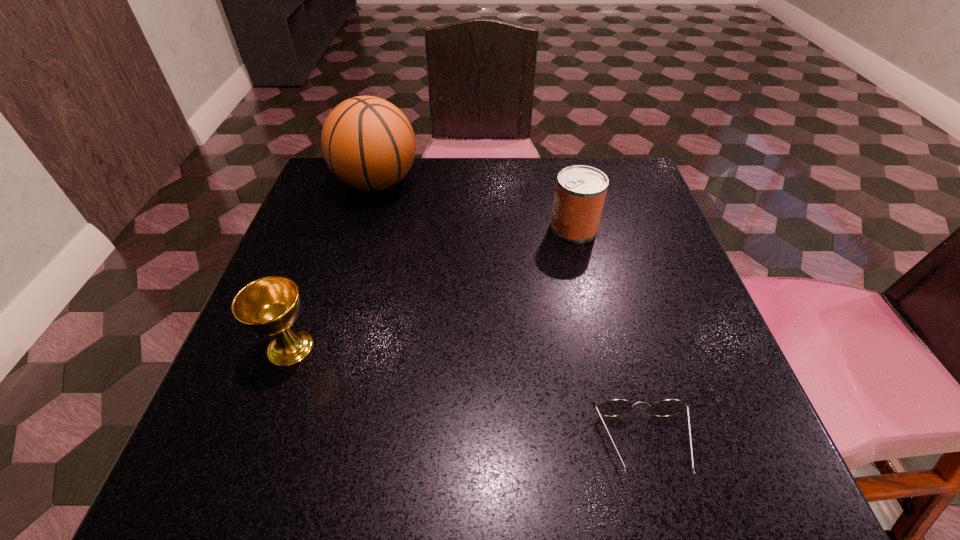
Where is `can situated at the far edge`? The height and width of the screenshot is (540, 960). can situated at the far edge is located at coordinates (580, 192).

At what (x,y) coordinates should I click in order to perform the action: click on object that is at the near edge. Please return your answer as a coordinate pair (x, y). Looking at the image, I should click on (615, 407).

At what (x,y) coordinates should I click in order to perform the action: click on basketball that is at the left edge. Please return your answer as a coordinate pair (x, y). Looking at the image, I should click on (367, 142).

Locate an element on the screen. This screenshot has width=960, height=540. chalice located in the left edge section of the desktop is located at coordinates (268, 306).

Identify the location of can that is at the right edge. This screenshot has width=960, height=540. (580, 192).

Where is `spectacles that is at the right edge`? This screenshot has height=540, width=960. spectacles that is at the right edge is located at coordinates tap(615, 407).

The height and width of the screenshot is (540, 960). I want to click on object that is positioned at the far left corner, so click(367, 142).

Find the location of `object at the far right corner`. object at the far right corner is located at coordinates (580, 192).

This screenshot has height=540, width=960. What are the coordinates of `object that is positioned at the near right corner` in the screenshot? It's located at (615, 407).

In the image, there is a desktop. Where is `free space at the far edge`? free space at the far edge is located at coordinates (429, 159).